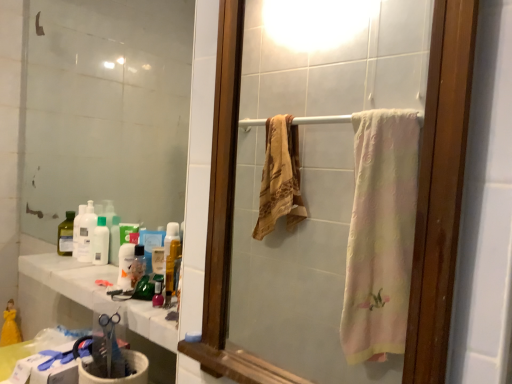
Question: Considering the relative positions of white glossy countertop at lower left and translucent plastic bottle at lower center in the image provided, is white glossy countertop at lower left to the left of translucent plastic bottle at lower center from the viewer's perspective?

Choices:
 (A) no
 (B) yes

Answer: (B)

Question: Is the position of white glossy countertop at lower left less distant than that of translucent plastic bottle at lower center?

Choices:
 (A) yes
 (B) no

Answer: (A)

Question: Can you confirm if white glossy countertop at lower left is positioned to the right of translucent plastic bottle at lower center?

Choices:
 (A) yes
 (B) no

Answer: (B)

Question: From the image's perspective, would you say white glossy countertop at lower left is shown under translucent plastic bottle at lower center?

Choices:
 (A) no
 (B) yes

Answer: (B)

Question: Does white glossy countertop at lower left have a lesser height compared to translucent plastic bottle at lower center?

Choices:
 (A) no
 (B) yes

Answer: (B)

Question: Is white glossy countertop at lower left bigger than translucent plastic bottle at lower center?

Choices:
 (A) no
 (B) yes

Answer: (B)

Question: Is translucent plastic bottle at center located outside white glossy countertop at lower left?

Choices:
 (A) no
 (B) yes

Answer: (B)

Question: Is translucent plastic bottle at center not close to white glossy countertop at lower left?

Choices:
 (A) yes
 (B) no

Answer: (B)

Question: Is the position of translucent plastic bottle at center more distant than that of white glossy countertop at lower left?

Choices:
 (A) no
 (B) yes

Answer: (B)

Question: Would you say translucent plastic bottle at center contains white glossy countertop at lower left?

Choices:
 (A) yes
 (B) no

Answer: (B)

Question: Does translucent plastic bottle at center turn towards white glossy countertop at lower left?

Choices:
 (A) no
 (B) yes

Answer: (A)

Question: Does translucent plastic bottle at center have a smaller size compared to white glossy countertop at lower left?

Choices:
 (A) no
 (B) yes

Answer: (B)

Question: Can you confirm if translucent plastic bottle at lower center is smaller than clear glass mirror at upper left, the 2th mirror in the right-to-left sequence?

Choices:
 (A) yes
 (B) no

Answer: (A)